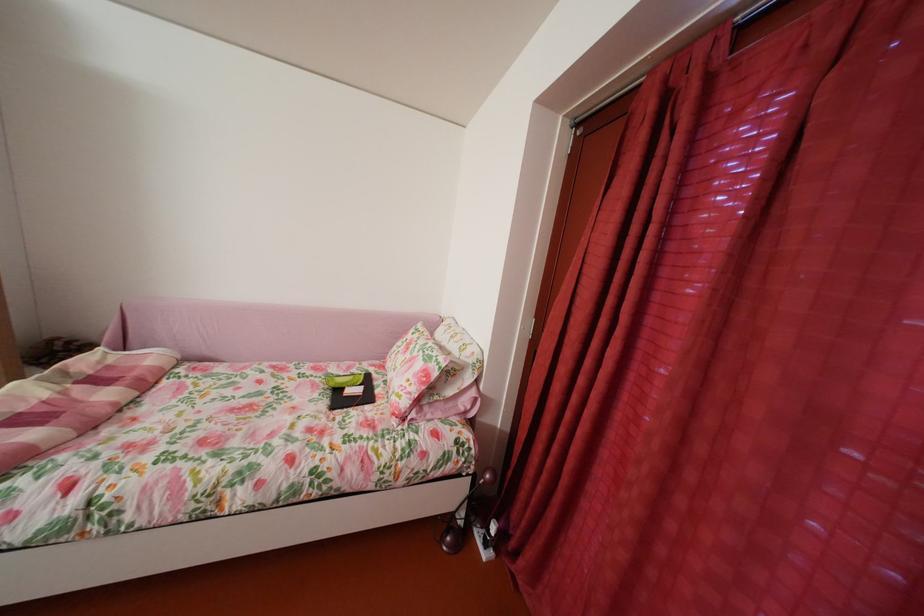
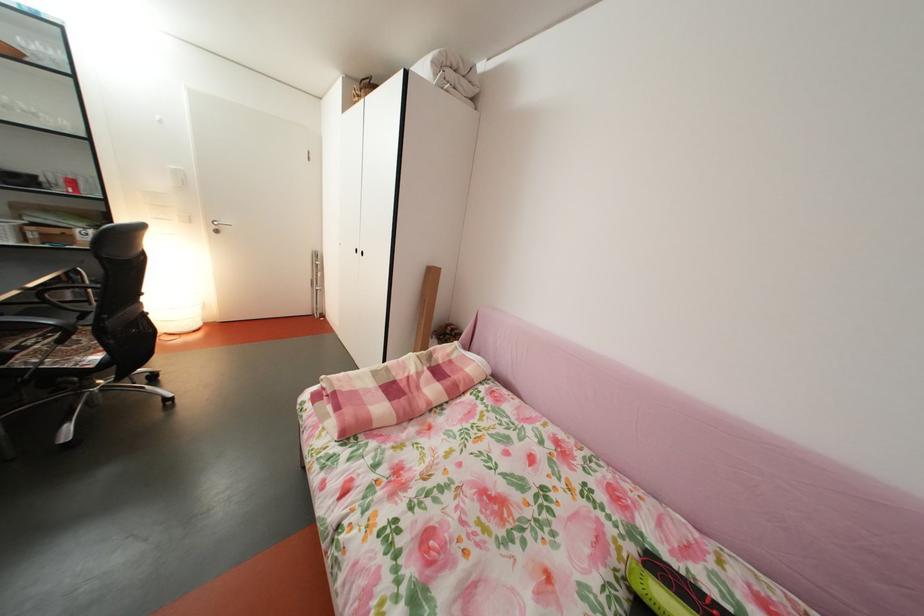
Question: The camera is either moving clockwise (left) or counter-clockwise (right) around the object. The first image is from the beginning of the video and the second image is from the end. Is the camera moving left or right when shooting the video?

Choices:
 (A) Left
 (B) Right

Answer: (B)